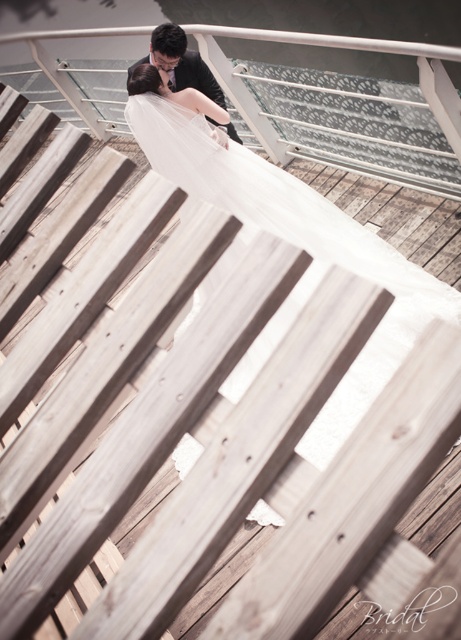
Which is above, white lace dress at upper center or black satin suit at center?

black satin suit at center is higher up.

Which is more to the left, white lace dress at upper center or black satin suit at center?

From the viewer's perspective, black satin suit at center appears more on the left side.

Who is more forward, (222, 202) or (178, 35)?

Point (178, 35) is more forward.

You are a GUI agent. You are given a task and a screenshot of the screen. Output one action in this format:
    pyautogui.click(x=<x>, y=<y>)
    Task: Click on the white lace dress at upper center
    
    Given the screenshot: What is the action you would take?
    pyautogui.click(x=297, y=244)